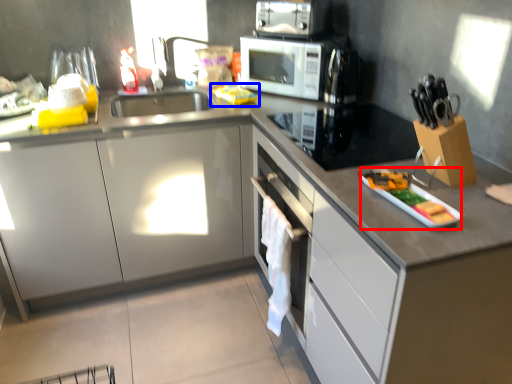
Question: Which object is closer to the camera taking this photo, appliance (highlighted by a red box) or food (highlighted by a blue box)?

Choices:
 (A) appliance
 (B) food

Answer: (A)